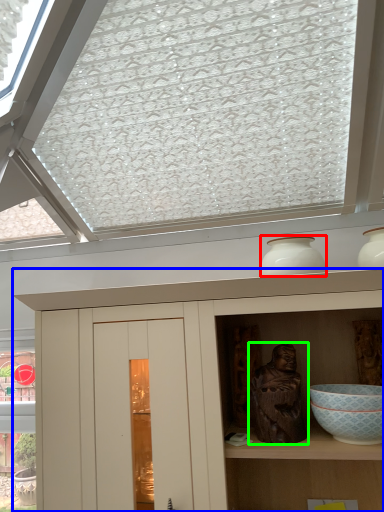
Question: Which is farther away from vase (highlighted by a red box)? cupboard (highlighted by a blue box) or sculpture (highlighted by a green box)?

Choices:
 (A) cupboard
 (B) sculpture

Answer: (A)